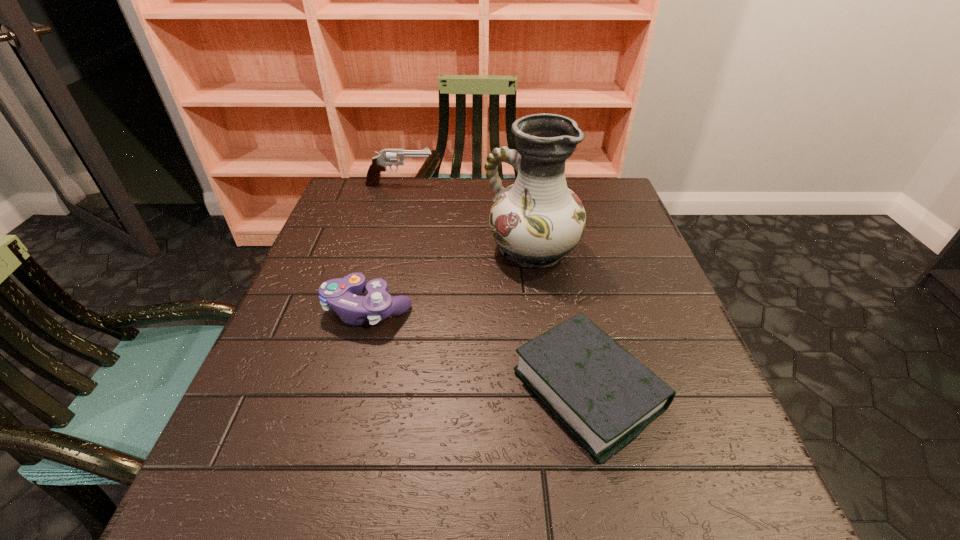
At what (x,y) coordinates should I click in order to perform the action: click on the third nearest object. Please return your answer as a coordinate pair (x, y). The width and height of the screenshot is (960, 540). Looking at the image, I should click on (537, 220).

Locate an element on the screen. vase is located at coordinates point(537,220).

Locate an element on the screen. the farthest object is located at coordinates (387, 157).

Locate an element on the screen. This screenshot has width=960, height=540. the second tallest object is located at coordinates (387, 157).

Image resolution: width=960 pixels, height=540 pixels. I want to click on control, so click(342, 294).

Where is `the shortest object`? the shortest object is located at coordinates (606, 397).

Identify the location of vacant space located on the right of the vase. Image resolution: width=960 pixels, height=540 pixels. (612, 249).

Find the location of a particular element. The height and width of the screenshot is (540, 960). free space located 0.180m at the muzzle of the gun is located at coordinates (494, 185).

Image resolution: width=960 pixels, height=540 pixels. What are the coordinates of `blank space located 0.330m on the front of the control` in the screenshot? It's located at (313, 517).

Find the location of a particular element. This screenshot has height=540, width=960. free space located 0.290m on the left of the shortest object is located at coordinates (348, 390).